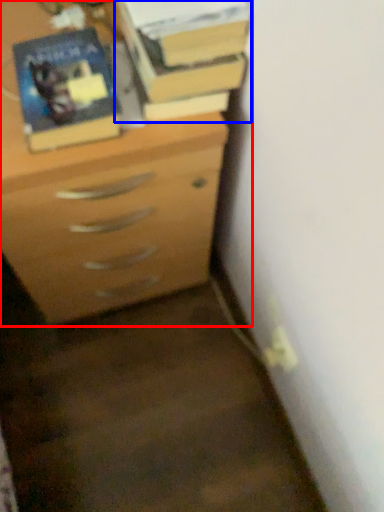
Question: Which point is closer to the camera, chest of drawers (highlighted by a red box) or book (highlighted by a blue box)?

Choices:
 (A) chest of drawers
 (B) book

Answer: (A)